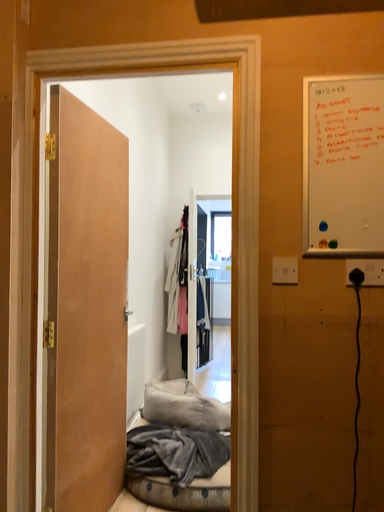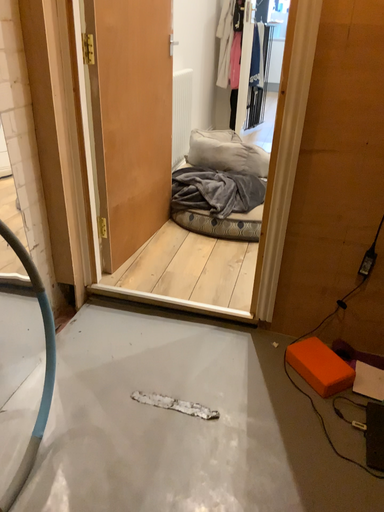
Question: How did the camera likely rotate when shooting the video?

Choices:
 (A) rotated downward
 (B) rotated upward

Answer: (A)